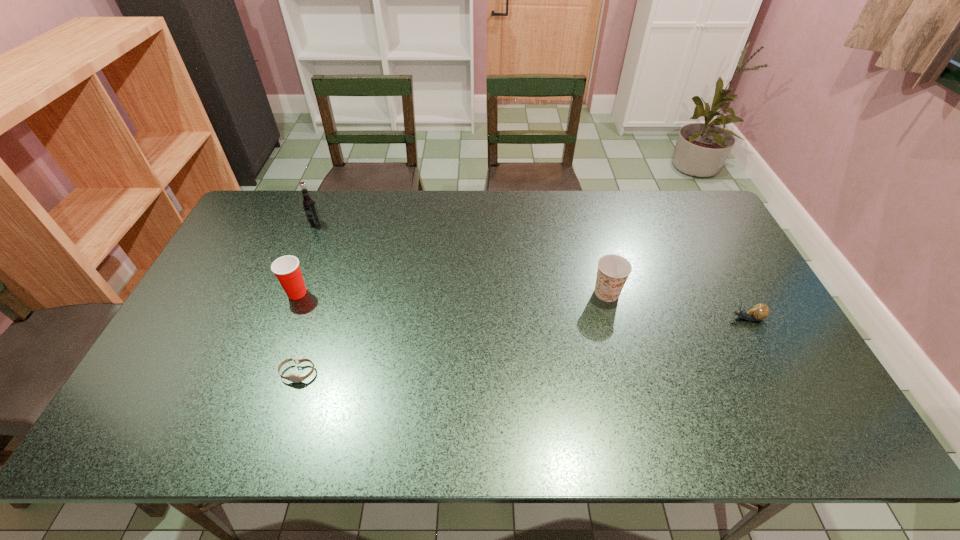
The height and width of the screenshot is (540, 960). I want to click on the closest object to the second shortest object, so click(613, 270).

The height and width of the screenshot is (540, 960). In order to click on the fourth closest object to the tallest object in this screenshot , I will do `click(760, 311)`.

Find the location of `free spot that satisfies the following two spatial constraints: 1. on the label of the fourth object from left to right; 2. on the left side of the farthest object`. free spot that satisfies the following two spatial constraints: 1. on the label of the fourth object from left to right; 2. on the left side of the farthest object is located at coordinates (286, 293).

Locate an element on the screen. Image resolution: width=960 pixels, height=540 pixels. vacant position in the image that satisfies the following two spatial constraints: 1. on the label of the left Dixie cup; 2. on the right side of the root beer is located at coordinates (286, 293).